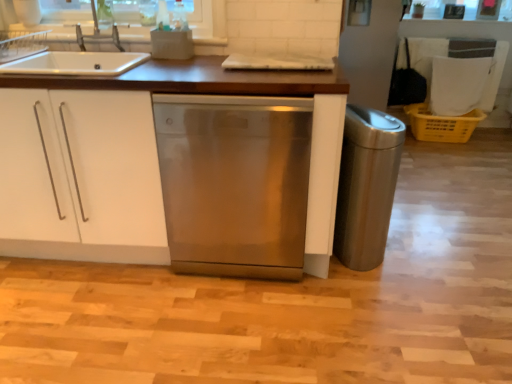
Question: From a real-world perspective, relative to stainless steel dishwasher at center, is stainless steel trash can at right vertically above or below?

Choices:
 (A) above
 (B) below

Answer: (B)

Question: Considering the positions of stainless steel trash can at right and stainless steel dishwasher at center in the image, is stainless steel trash can at right taller or shorter than stainless steel dishwasher at center?

Choices:
 (A) short
 (B) tall

Answer: (A)

Question: Which object is positioned closest to the stainless steel trash can at right?

Choices:
 (A) yellow plastic crate at right
 (B) stainless steel dishwasher at center
 (C) satin silver sink at upper left
 (D) white matte cabinet at center

Answer: (B)

Question: Which object is the closest to the yellow plastic crate at right?

Choices:
 (A) satin silver sink at upper left
 (B) stainless steel dishwasher at center
 (C) stainless steel trash can at right
 (D) white matte cabinet at center

Answer: (C)